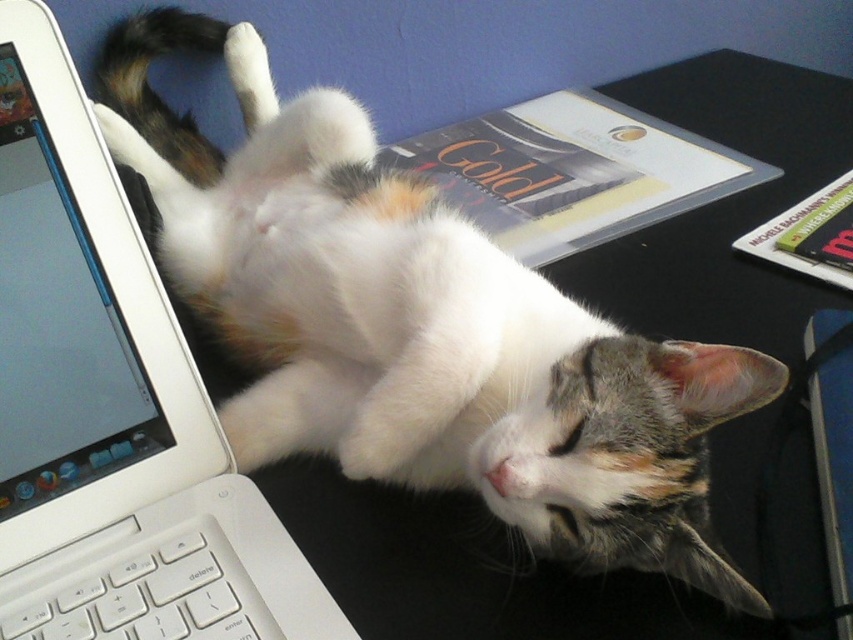
You are organizing the desk and want to place a new item between the gold paper folder at upper center and the white plastic keyboard at lower left. Based on their sizes, which object should you place closer to the edge of the desk to avoid overcrowding?

The white plastic keyboard at lower left is shorter, so placing it closer to the edge would leave more space for the taller gold paper folder at upper center, preventing overcrowding.

You are organizing a desk and need to place a new mouse next to the white plastic laptop at left and the white plastic keyboard at lower left. Since the mouse is small, which object should you place it closer to?

The white plastic keyboard at lower left is smaller than the white plastic laptop at left, so placing the mouse closer to the white plastic keyboard at lower left would be better as it can fit better next to the smaller object.

You are trying to place a small plant pot on the desk next to the cat. The plant pot requires at least 10 cm of space to the left of the cat. Can you place it there without moving the white plastic laptop at left?

The white plastic laptop at left is located at point (111, 404), which is to the left of the cat. Since the plant pot needs 10 cm of space to the left of the cat, placing it there would interfere with the laptop. Therefore, you cannot place the plant pot there without moving the white plastic laptop at left.